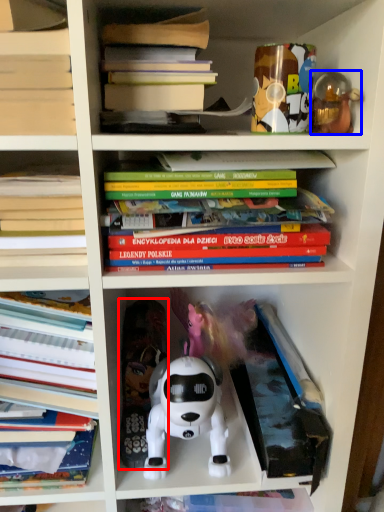
Question: Which object is closer to the camera taking this photo, toy (highlighted by a red box) or toy (highlighted by a blue box)?

Choices:
 (A) toy
 (B) toy

Answer: (B)